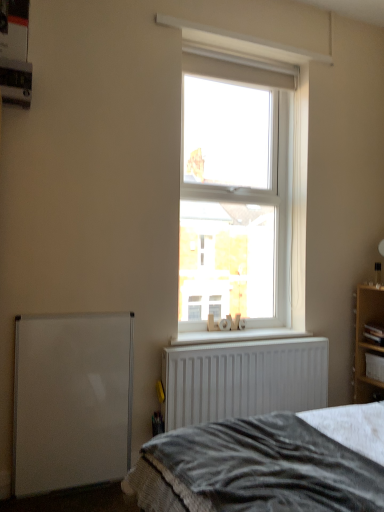
What are the coordinates of `free space above white textured wood at center (from a real-world perspective)` in the screenshot? It's located at (220, 333).